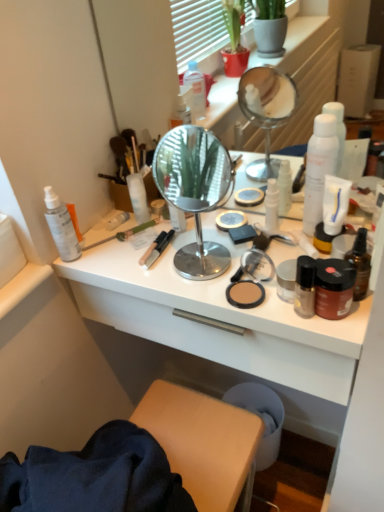
You are a GUI agent. You are given a task and a screenshot of the screen. Output one action in this format:
    pyautogui.click(x=<x>, y=<y>)
    Task: Click on the vacant space to the right of white matte spray can at left, marked as the second toiletry in a left-to-right arrangement
    The width and height of the screenshot is (384, 512).
    Given the screenshot: What is the action you would take?
    pyautogui.click(x=149, y=249)